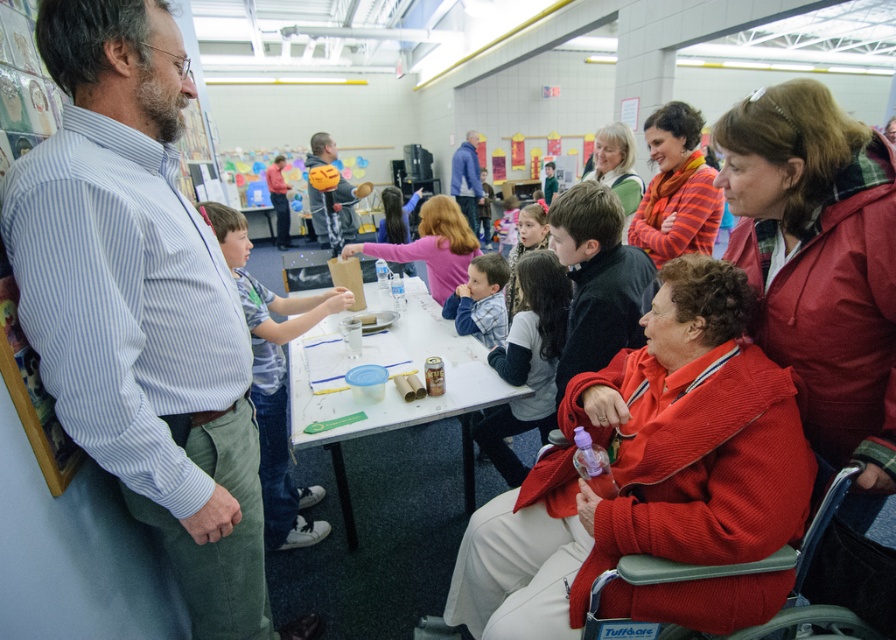
Question: Estimate the real-world distances between objects in this image. Which object is farther from the plaid shirt at center?

Choices:
 (A) plaid fabric shirt at center
 (B) blue fleece jacket at center

Answer: (B)

Question: Considering the relative positions of blue striped shirt at center and pink fabric shirt at center in the image provided, where is blue striped shirt at center located with respect to pink fabric shirt at center?

Choices:
 (A) left
 (B) right

Answer: (A)

Question: Does red corduroy jacket at right appear over pink fabric shirt at center?

Choices:
 (A) yes
 (B) no

Answer: (B)

Question: Which object appears closest to the camera in this image?

Choices:
 (A) plaid fabric shirt at center
 (B) orange knitted scarf at upper center

Answer: (B)

Question: Which object appears closest to the camera in this image?

Choices:
 (A) red corduroy jacket at right
 (B) orange helmet at center
 (C) gray fabric wheelchair at lower right

Answer: (A)

Question: Can you confirm if plaid shirt at center is bigger than gray fabric wheelchair at lower right?

Choices:
 (A) no
 (B) yes

Answer: (B)